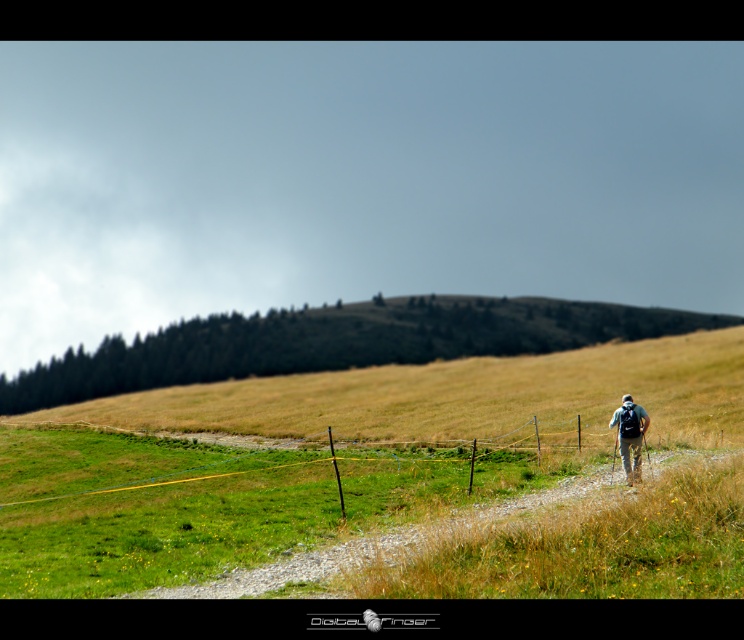
Which of these two, green grass at center or green grassy hillside at center, stands taller?

With more height is green grassy hillside at center.

Is the position of green grass at center more distant than that of green grassy hillside at center?

No, it is not.

This screenshot has height=640, width=744. What do you see at coordinates (324, 456) in the screenshot?
I see `green grass at center` at bounding box center [324, 456].

Locate an element on the screen. Image resolution: width=744 pixels, height=640 pixels. green grass at center is located at coordinates (324, 456).

Can you confirm if green grassy hillside at center is positioned below camouflage fabric backpack at right?

Indeed, green grassy hillside at center is positioned under camouflage fabric backpack at right.

Between green grassy hillside at center and camouflage fabric backpack at right, which one has less height?

camouflage fabric backpack at right is shorter.

Which is in front, point (1, 403) or point (618, 440)?

Positioned in front is point (618, 440).

At what (x,y) coordinates should I click in order to perform the action: click on green grassy hillside at center. Please return your answer as a coordinate pair (x, y). This screenshot has height=640, width=744. Looking at the image, I should click on (339, 342).

Does green grass at center appear on the left side of camouflage fabric backpack at right?

Indeed, green grass at center is positioned on the left side of camouflage fabric backpack at right.

Who is taller, green grass at center or camouflage fabric backpack at right?

green grass at center

Find the location of `green grass at center`. green grass at center is located at coordinates point(324,456).

Identify the location of green grass at center. (324, 456).